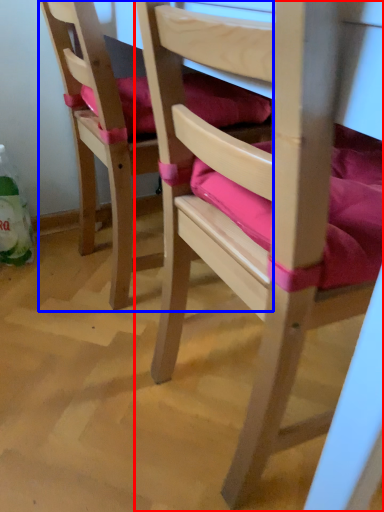
Question: Which object is closer to the camera taking this photo, chair (highlighted by a red box) or chair (highlighted by a blue box)?

Choices:
 (A) chair
 (B) chair

Answer: (A)